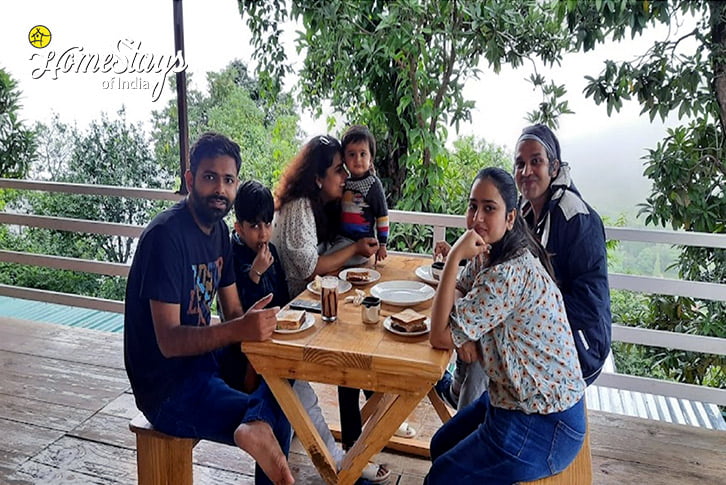
Image resolution: width=726 pixels, height=485 pixels. Find the location of `table`. table is located at coordinates (363, 351).